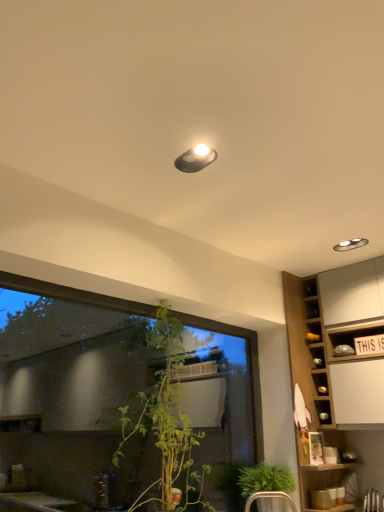
Question: Does matte black light fixture at upper center appear on the right side of metallic silver armchair at lower center?

Choices:
 (A) no
 (B) yes

Answer: (A)

Question: From a real-world perspective, is matte black light fixture at upper center beneath metallic silver armchair at lower center?

Choices:
 (A) no
 (B) yes

Answer: (A)

Question: Can you confirm if matte black light fixture at upper center is bigger than metallic silver armchair at lower center?

Choices:
 (A) yes
 (B) no

Answer: (B)

Question: Is matte black light fixture at upper center smaller than metallic silver armchair at lower center?

Choices:
 (A) yes
 (B) no

Answer: (A)

Question: Is the depth of matte black light fixture at upper center greater than that of metallic silver armchair at lower center?

Choices:
 (A) yes
 (B) no

Answer: (B)

Question: From the image's perspective, is matte black light fixture at upper center on metallic silver armchair at lower center?

Choices:
 (A) yes
 (B) no

Answer: (A)

Question: Is metallic silver armchair at lower center outside of wooden cabinet at right?

Choices:
 (A) yes
 (B) no

Answer: (A)

Question: Would you say wooden cabinet at right is part of metallic silver armchair at lower center's contents?

Choices:
 (A) no
 (B) yes

Answer: (A)

Question: Is the depth of metallic silver armchair at lower center less than that of wooden cabinet at right?

Choices:
 (A) yes
 (B) no

Answer: (A)

Question: Is metallic silver armchair at lower center aimed at wooden cabinet at right?

Choices:
 (A) yes
 (B) no

Answer: (B)

Question: From the image's perspective, is metallic silver armchair at lower center below wooden cabinet at right?

Choices:
 (A) no
 (B) yes

Answer: (B)

Question: Considering the relative sizes of metallic silver armchair at lower center and wooden cabinet at right in the image provided, is metallic silver armchair at lower center taller than wooden cabinet at right?

Choices:
 (A) no
 (B) yes

Answer: (A)

Question: Would you consider transparent glass window at center to be distant from green leafy plant at lower center?

Choices:
 (A) no
 (B) yes

Answer: (A)